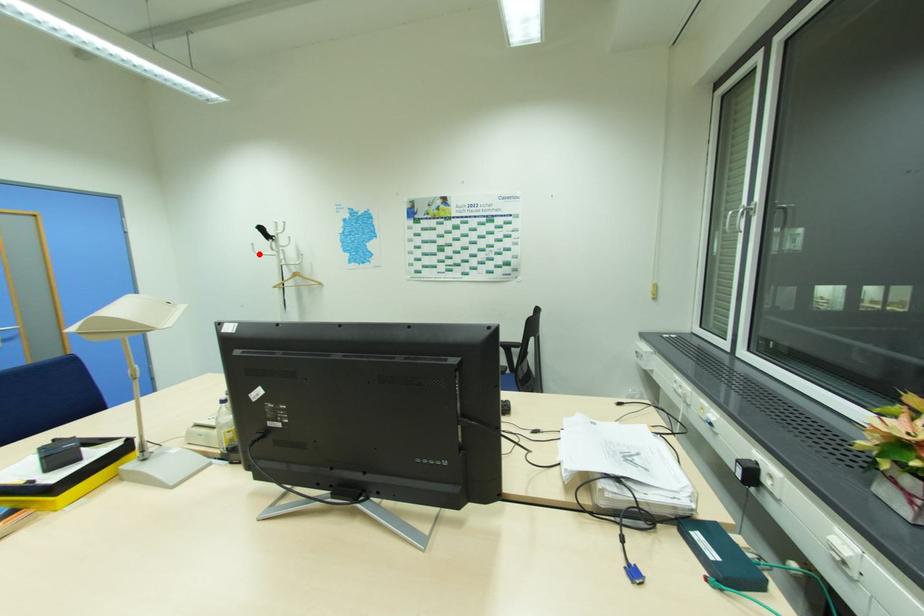
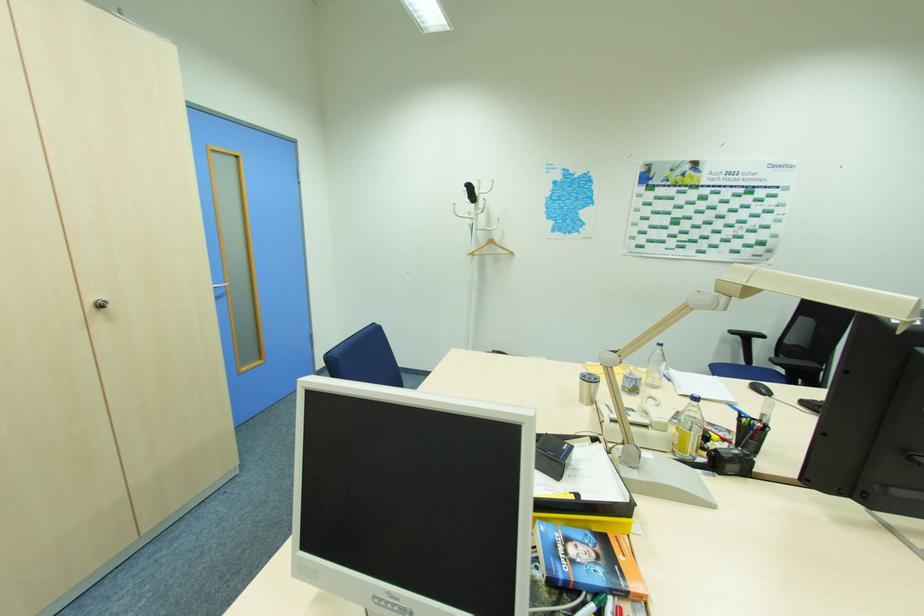
Where in the second image is the point corresponding to the highlighted location from the first image?

(459, 216)